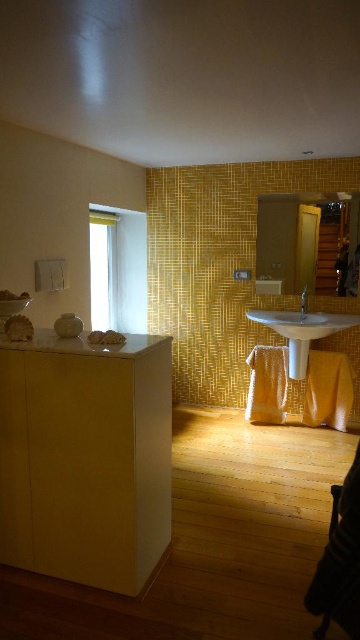
Can you confirm if matte yellow cabinet at left is positioned below satin nickel faucet at center?

Correct, matte yellow cabinet at left is located below satin nickel faucet at center.

Can you confirm if matte yellow cabinet at left is smaller than satin nickel faucet at center?

No.

Between point (77, 397) and point (304, 300), which one is positioned in front?

Point (77, 397) is more forward.

This screenshot has width=360, height=640. I want to click on matte yellow cabinet at left, so click(86, 458).

Is point (105, 228) in front of point (303, 310)?

That is False.

Is white sheer curtain at upper left below satin nickel faucet at center?

Incorrect, white sheer curtain at upper left is not positioned below satin nickel faucet at center.

Does point (114, 256) lie behind point (306, 289)?

Yes, it is behind point (306, 289).

Locate an element on the screen. white sheer curtain at upper left is located at coordinates (102, 269).

Can you confirm if wooden chair at lower right is wider than satin nickel faucet at center?

Correct, the width of wooden chair at lower right exceeds that of satin nickel faucet at center.

Can you confirm if wooden chair at lower right is taller than satin nickel faucet at center?

Indeed, wooden chair at lower right has a greater height compared to satin nickel faucet at center.

What are the coordinates of `wooden chair at lower right` in the screenshot? It's located at (339, 561).